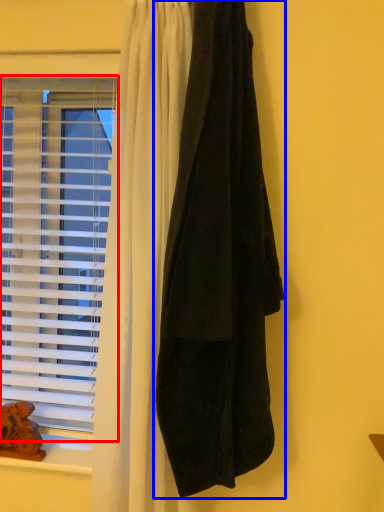
Question: Which of the following is the farthest to the observer, window (highlighted by a red box) or curtain (highlighted by a blue box)?

Choices:
 (A) window
 (B) curtain

Answer: (A)